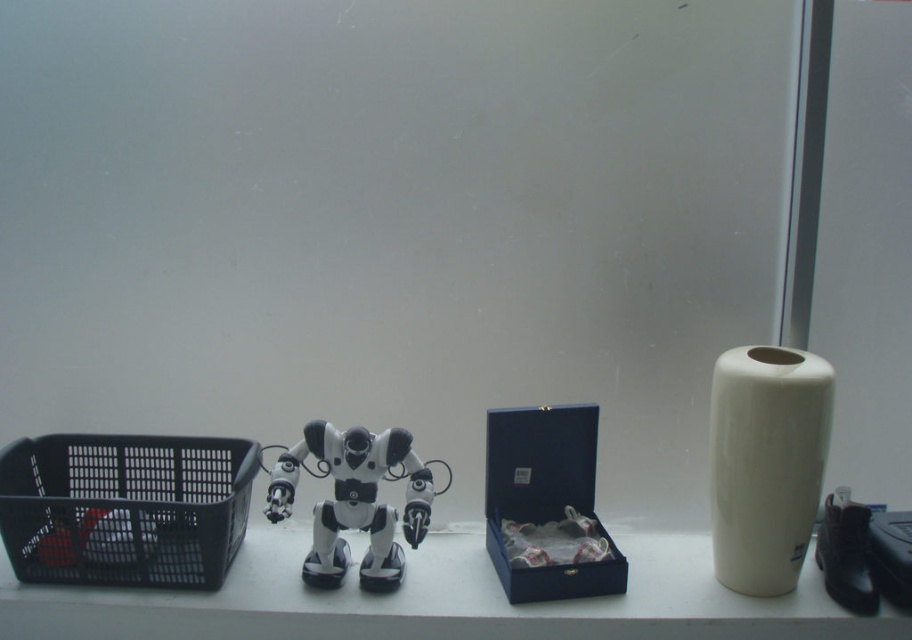
Measure the distance between white glossy vase at right and camera.

A distance of 4.55 feet exists between white glossy vase at right and camera.

In the scene shown: Does white glossy vase at right have a larger size compared to matte blue box at center?

Correct, white glossy vase at right is larger in size than matte blue box at center.

Between point (776, 582) and point (548, 476), which one is positioned in front?

Positioned in front is point (776, 582).

Identify the location of white glossy vase at right. This screenshot has height=640, width=912. 765,464.

Between white plastic robot at center and metallic silver robot at center, which one appears on the left side from the viewer's perspective?

metallic silver robot at center

Does white plastic robot at center have a smaller size compared to metallic silver robot at center?

Incorrect, white plastic robot at center is not smaller in size than metallic silver robot at center.

Is point (342, 568) farther from viewer compared to point (267, 497)?

Yes, point (342, 568) is behind point (267, 497).

You are a GUI agent. You are given a task and a screenshot of the screen. Output one action in this format:
    pyautogui.click(x=<x>, y=<y>)
    Task: Click on the white plastic robot at center
    
    Given the screenshot: What is the action you would take?
    pyautogui.click(x=354, y=500)

Is point (184, 579) closer to viewer compared to point (306, 429)?

Yes, it is in front of point (306, 429).

In order to click on black plastic basket at left in this screenshot , I will do `click(125, 508)`.

At what (x,y) coordinates should I click in order to perform the action: click on black plastic basket at left. Please return your answer as a coordinate pair (x, y). The image size is (912, 640). Looking at the image, I should click on (125, 508).